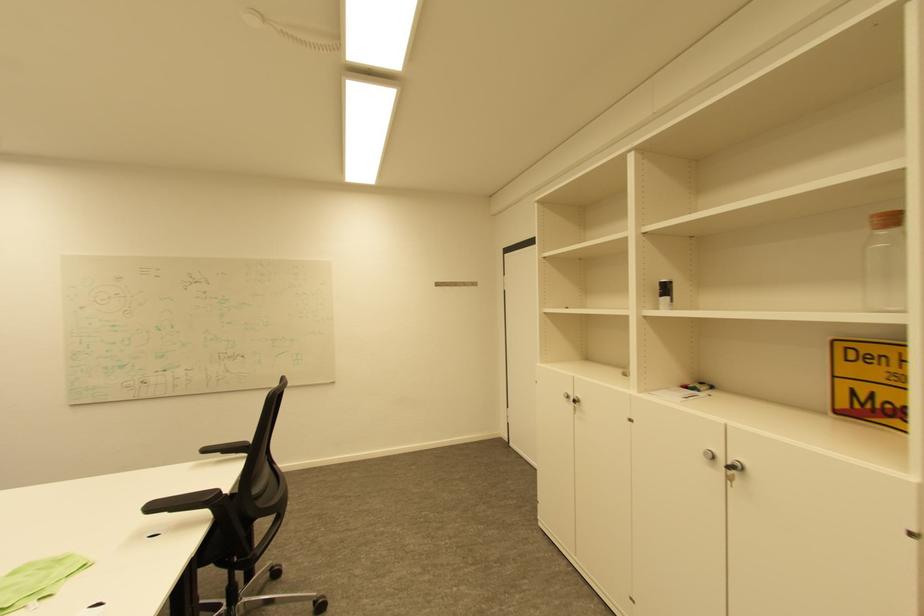
Where would you turn the key in lock? Please return your answer as a coordinate pair (x, y).

(751, 480)